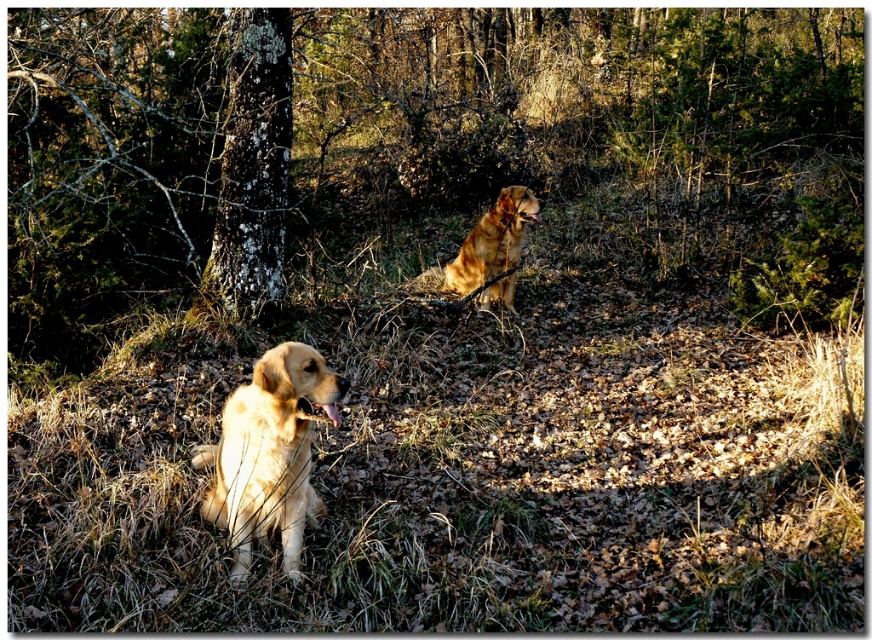
Who is more forward, (260, 112) or (277, 396)?

Positioned in front is point (277, 396).

Who is positioned more to the left, smooth bark tree at center or golden fur dog at lower left?

From the viewer's perspective, smooth bark tree at center appears more on the left side.

Does point (249, 214) lie behind point (218, 513)?

Yes, point (249, 214) is farther from viewer.

Find the location of a particular element. Image resolution: width=872 pixels, height=640 pixels. smooth bark tree at center is located at coordinates (253, 166).

Consider the image. Can you confirm if smooth bark tree at center is thinner than golden fur dog at center?

Indeed, smooth bark tree at center has a lesser width compared to golden fur dog at center.

Who is shorter, smooth bark tree at center or golden fur dog at center?

With less height is golden fur dog at center.

Is point (261, 177) positioned behind point (443, 275)?

No, (261, 177) is closer to viewer.

At what (x,y) coordinates should I click in order to perform the action: click on smooth bark tree at center. Please return your answer as a coordinate pair (x, y). Image resolution: width=872 pixels, height=640 pixels. Looking at the image, I should click on (253, 166).

Who is more forward, (290, 525) or (494, 257)?

Point (290, 525)

Who is more distant from viewer, (297, 348) or (501, 225)?

Positioned behind is point (501, 225).

Does point (270, 476) come farther from viewer compared to point (468, 285)?

No, it is not.

The height and width of the screenshot is (640, 872). In order to click on golden fur dog at lower left in this screenshot , I will do `click(270, 452)`.